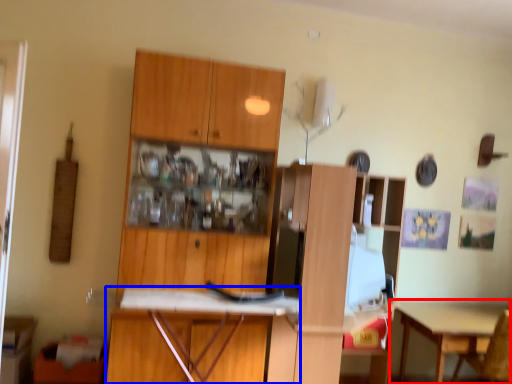
Question: Which object appears closest to the camera in this image, table (highlighted by a red box) or desk (highlighted by a blue box)?

Choices:
 (A) table
 (B) desk

Answer: (B)